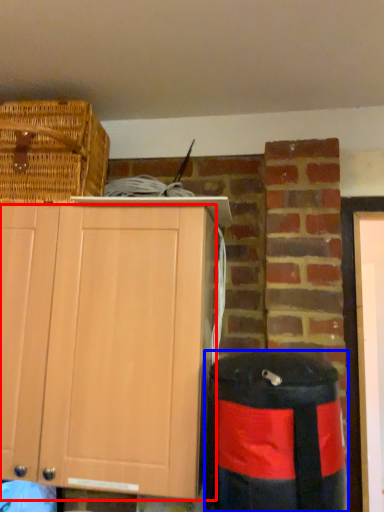
Question: Which object is further to the camera taking this photo, cabinetry (highlighted by a red box) or trash bin/can (highlighted by a blue box)?

Choices:
 (A) cabinetry
 (B) trash bin/can

Answer: (A)